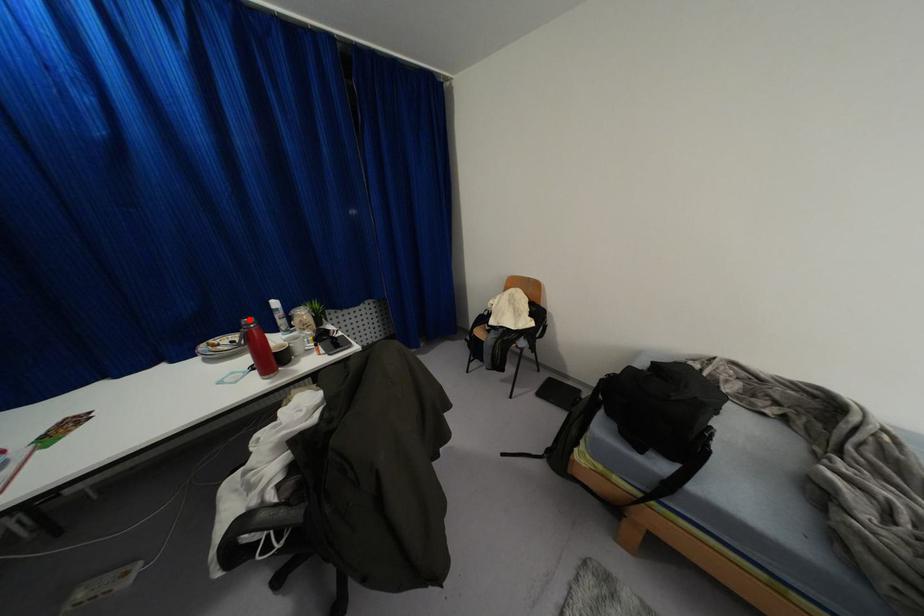
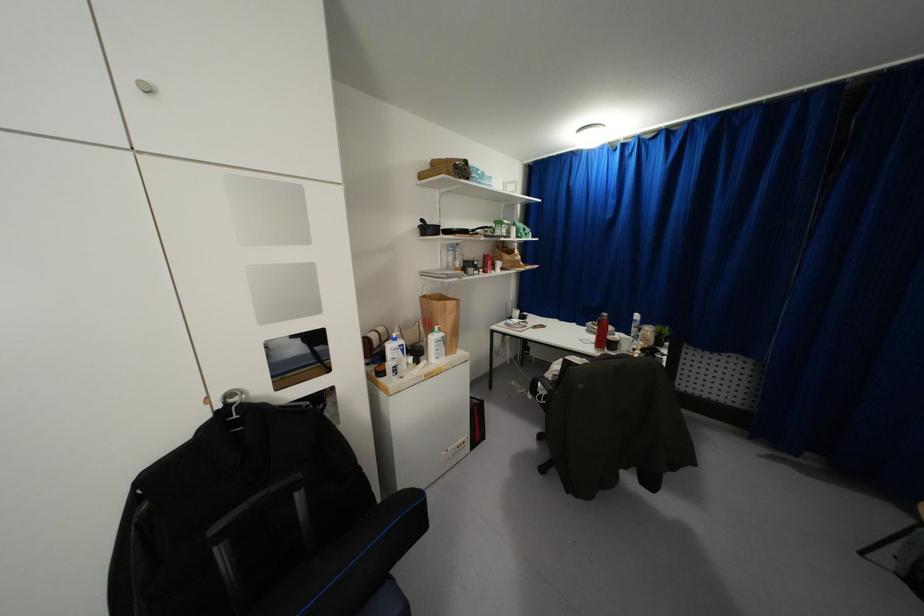
Where in the second image is the point corresponding to the highlighted location from the first image?

(603, 314)